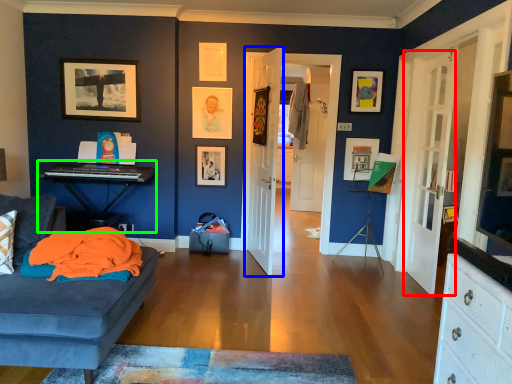
Question: Based on their relative distances, which object is nearer to door (highlighted by a red box)? Choose from door (highlighted by a blue box) and computer desk (highlighted by a green box).

Choices:
 (A) door
 (B) computer desk

Answer: (A)